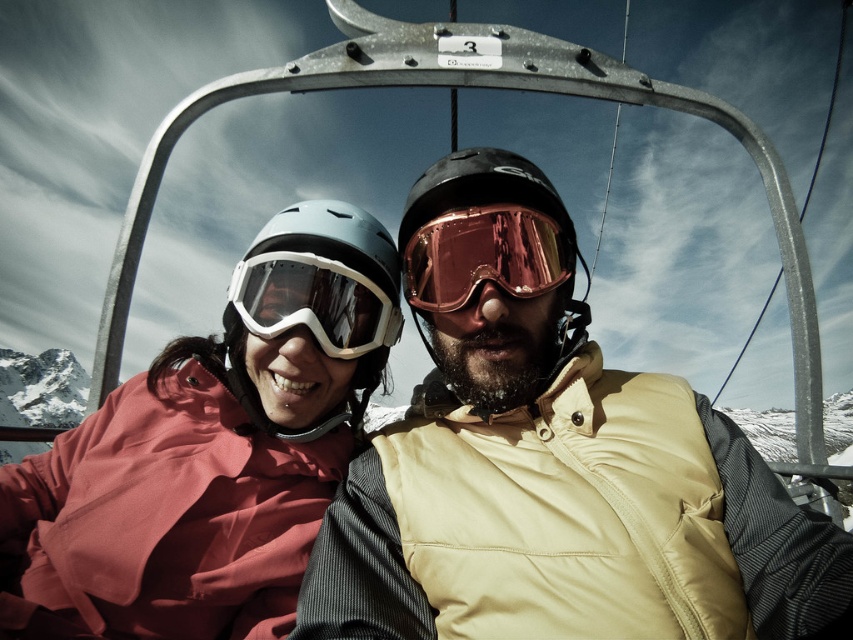
Question: Is rose gold reflective goggles at center closer to camera compared to transparent matte ski goggles at center?

Choices:
 (A) no
 (B) yes

Answer: (A)

Question: Which point is closer to the camera?

Choices:
 (A) (222, 321)
 (B) (91, 518)
 (C) (451, 196)

Answer: (B)

Question: Which object is positioned farthest from the rose gold reflective goggles at center?

Choices:
 (A) matte pink jacket at left
 (B) matte gray helmet at center
 (C) transparent matte ski goggles at center
 (D) glossy plastic helmet at center

Answer: (A)

Question: Which object appears closest to the camera in this image?

Choices:
 (A) transparent matte ski goggles at center
 (B) glossy plastic helmet at center
 (C) matte pink jacket at left

Answer: (C)

Question: Is matte pink jacket at left bigger than transparent matte ski goggles at center?

Choices:
 (A) no
 (B) yes

Answer: (B)

Question: Is matte gray helmet at center bigger than glossy plastic helmet at center?

Choices:
 (A) no
 (B) yes

Answer: (A)